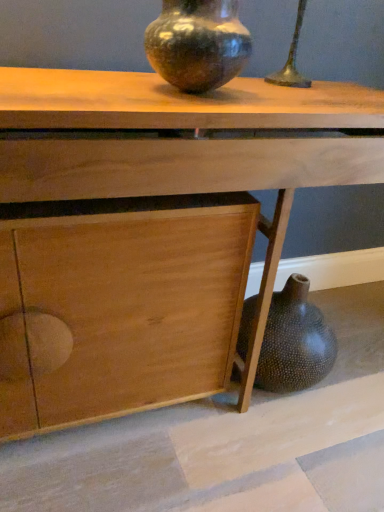
I want to click on free point above wooden table at center (from a real-world perspective), so click(x=193, y=95).